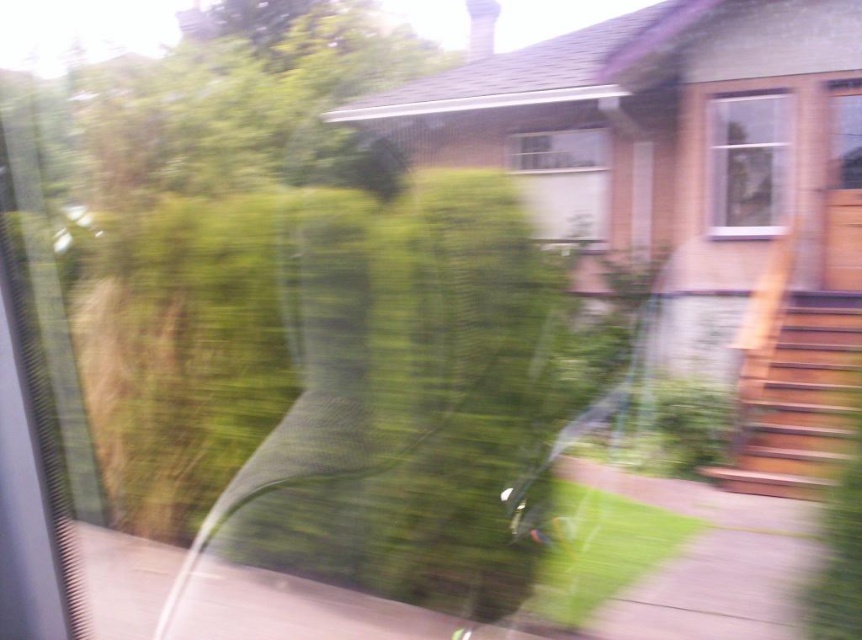
You are a delivery person trying to see the address number on the house through the transparent plastic screen door at upper right and the clear glass window at center. Which one allows you to see the address number more clearly?

The clear glass window at center allows you to see the address number more clearly because it is larger than the transparent plastic screen door at upper right.

Looking at this image, you are inside a moving car and want to know how far you are from the point at coordinates (x=710, y=99) outside the window. Can you determine the distance?

The distance between the viewer and the point at coordinates (x=710, y=99) is 8.62 meters.

You are a passenger in the car and want to look outside. Which window, the white glass window at upper right or the clear glass window at center, would allow you to see more of the outside view?

The white glass window at upper right is larger in size than the clear glass window at center, so it would allow you to see more of the outside view.